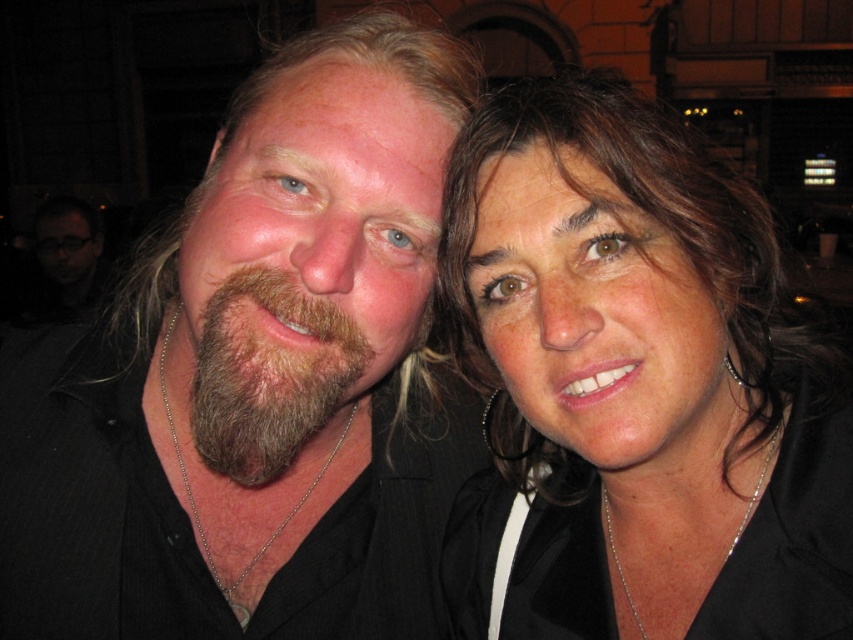
Question: Is matte black hair at upper right to the right of brown fuzzy beard at left from the viewer's perspective?

Choices:
 (A) yes
 (B) no

Answer: (A)

Question: Which object is farther from the camera taking this photo?

Choices:
 (A) matte black hair at upper right
 (B) brown fuzzy beard at left

Answer: (B)

Question: Which point is closer to the camera?

Choices:
 (A) matte black hair at upper right
 (B) brown fuzzy beard at left

Answer: (A)

Question: Does matte black hair at upper right have a smaller size compared to brown fuzzy beard at left?

Choices:
 (A) yes
 (B) no

Answer: (B)

Question: Is matte black hair at upper right smaller than brown fuzzy beard at left?

Choices:
 (A) no
 (B) yes

Answer: (A)